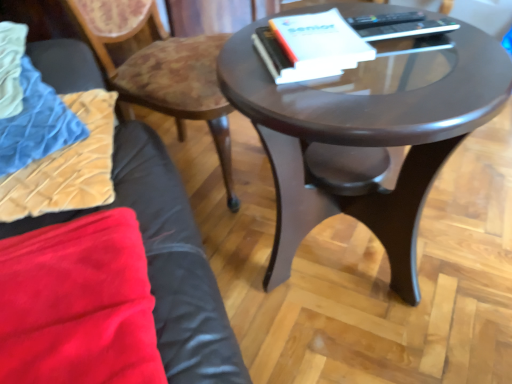
Question: Is velvet blue blanket at left at the back of glossy dark wood coffee table at center?

Choices:
 (A) no
 (B) yes

Answer: (B)

Question: From the image's perspective, is glossy dark wood coffee table at center beneath velvet blue blanket at left?

Choices:
 (A) no
 (B) yes

Answer: (B)

Question: Is glossy dark wood coffee table at center not near velvet blue blanket at left?

Choices:
 (A) no
 (B) yes

Answer: (A)

Question: From the image's perspective, is glossy dark wood coffee table at center on velvet blue blanket at left?

Choices:
 (A) no
 (B) yes

Answer: (A)

Question: Considering the relative sizes of glossy dark wood coffee table at center and velvet blue blanket at left in the image provided, is glossy dark wood coffee table at center thinner than velvet blue blanket at left?

Choices:
 (A) no
 (B) yes

Answer: (A)

Question: In the image, is velvet blue blanket at left on the left side or the right side of wooden textured chair at upper left?

Choices:
 (A) left
 (B) right

Answer: (A)

Question: From a real-world perspective, is velvet blue blanket at left above or below wooden textured chair at upper left?

Choices:
 (A) below
 (B) above

Answer: (B)

Question: Is point (20, 81) positioned closer to the camera than point (163, 31)?

Choices:
 (A) closer
 (B) farther

Answer: (A)

Question: Is velvet blue blanket at left wider or thinner than wooden textured chair at upper left?

Choices:
 (A) thin
 (B) wide

Answer: (A)

Question: Considering the positions of point (33, 187) and point (76, 139), is point (33, 187) closer or farther from the camera than point (76, 139)?

Choices:
 (A) closer
 (B) farther

Answer: (A)

Question: Considering the positions of velvet beige pillow at lower left and velvet blue blanket at left in the image, is velvet beige pillow at lower left wider or thinner than velvet blue blanket at left?

Choices:
 (A) wide
 (B) thin

Answer: (A)

Question: Is velvet beige pillow at lower left taller or shorter than velvet blue blanket at left?

Choices:
 (A) tall
 (B) short

Answer: (B)

Question: Looking at the image, does velvet beige pillow at lower left seem bigger or smaller compared to velvet blue blanket at left?

Choices:
 (A) big
 (B) small

Answer: (B)

Question: Does point (501, 87) appear closer or farther from the camera than point (187, 84)?

Choices:
 (A) closer
 (B) farther

Answer: (A)

Question: From the image's perspective, is glossy dark wood coffee table at center above or below wooden textured chair at upper left?

Choices:
 (A) above
 (B) below

Answer: (B)